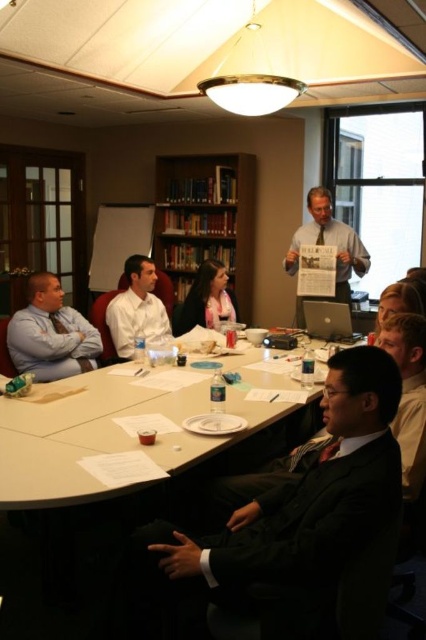
Question: Among these points, which one is farthest from the camera?

Choices:
 (A) (192, 312)
 (B) (175, 173)

Answer: (B)

Question: Considering the real-world distances, which object is closest to the white shirt at upper center?

Choices:
 (A) white shirt at center
 (B) wooden bookshelf at center
 (C) dark suit at center

Answer: (B)

Question: Where is dark suit at center located in relation to matte blue shirt at left in the image?

Choices:
 (A) left
 (B) right

Answer: (B)

Question: Which of the following is the farthest from the observer?

Choices:
 (A) (238, 168)
 (B) (347, 429)

Answer: (A)

Question: Can you confirm if wooden bookshelf at center is bigger than white shirt at center?

Choices:
 (A) yes
 (B) no

Answer: (A)

Question: Does dark suit at center appear under matte blue shirt at left?

Choices:
 (A) yes
 (B) no

Answer: (A)